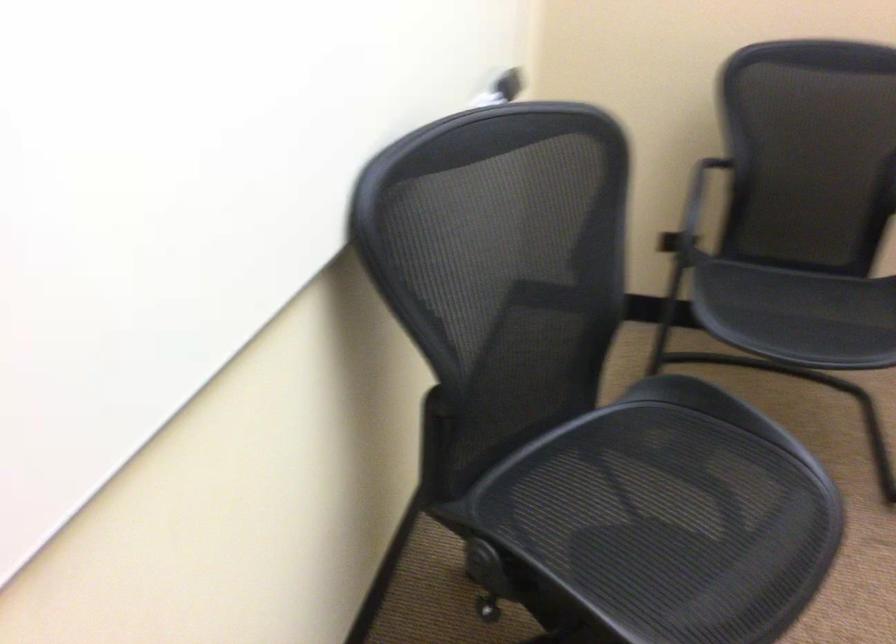
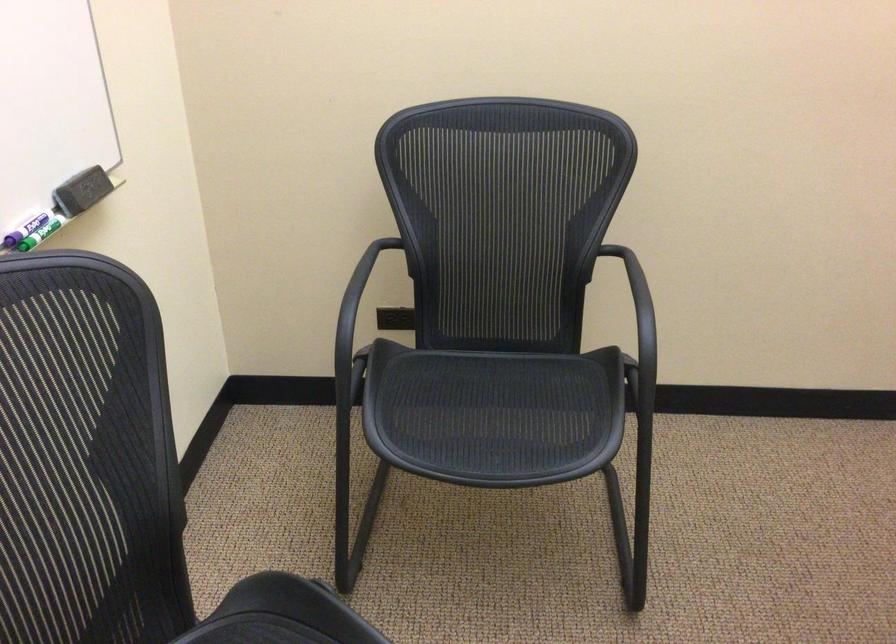
Find the pixel in the second image that matches pixel 500 73 in the first image.

(82, 191)